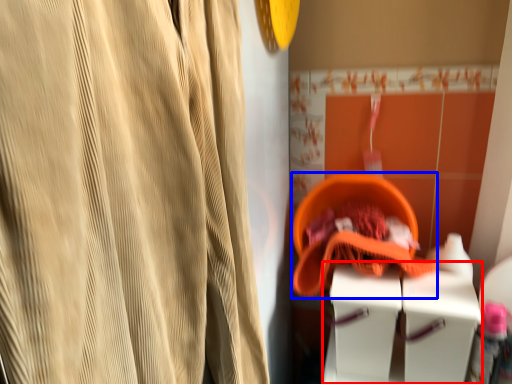
Question: Which of the following is the closest to the observer, vanity (highlighted by a red box) or basket (highlighted by a blue box)?

Choices:
 (A) vanity
 (B) basket

Answer: (A)